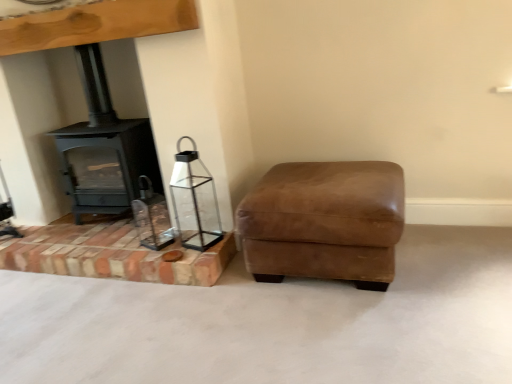
Question: Should I look upward or downward to see matte black wood burning stove at left?

Choices:
 (A) up
 (B) down

Answer: (A)

Question: Can you see clear glass lantern at lower left touching suede brown ottoman at lower right?

Choices:
 (A) no
 (B) yes

Answer: (A)

Question: Is clear glass lantern at lower left positioned before suede brown ottoman at lower right?

Choices:
 (A) no
 (B) yes

Answer: (A)

Question: From the image's perspective, does clear glass lantern at lower left appear lower than suede brown ottoman at lower right?

Choices:
 (A) no
 (B) yes

Answer: (A)

Question: Is suede brown ottoman at lower right surrounded by clear glass lantern at lower left?

Choices:
 (A) no
 (B) yes

Answer: (A)

Question: From the image's perspective, does clear glass lantern at lower left appear higher than suede brown ottoman at lower right?

Choices:
 (A) yes
 (B) no

Answer: (A)

Question: Is clear glass lantern at lower left to the left of suede brown ottoman at lower right from the viewer's perspective?

Choices:
 (A) no
 (B) yes

Answer: (B)

Question: Considering the relative positions of suede brown ottoman at lower right and clear glass lantern at lower left in the image provided, is suede brown ottoman at lower right to the right of clear glass lantern at lower left from the viewer's perspective?

Choices:
 (A) yes
 (B) no

Answer: (A)

Question: Is suede brown ottoman at lower right looking in the opposite direction of clear glass lantern at lower left?

Choices:
 (A) yes
 (B) no

Answer: (B)

Question: Is suede brown ottoman at lower right to the left of clear glass lantern at lower left from the viewer's perspective?

Choices:
 (A) no
 (B) yes

Answer: (A)

Question: Would you consider suede brown ottoman at lower right to be distant from clear glass lantern at lower left?

Choices:
 (A) yes
 (B) no

Answer: (B)

Question: Is suede brown ottoman at lower right further to the viewer compared to clear glass lantern at lower left?

Choices:
 (A) yes
 (B) no

Answer: (B)

Question: Does suede brown ottoman at lower right have a smaller size compared to clear glass lantern at lower left?

Choices:
 (A) no
 (B) yes

Answer: (A)

Question: Does suede brown ottoman at lower right have a greater width compared to matte black wood burning stove at left?

Choices:
 (A) no
 (B) yes

Answer: (B)